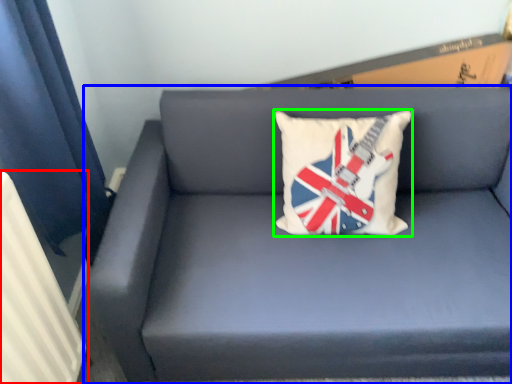
Question: Which is nearer to the radiator (highlighted by a red box)? studio couch (highlighted by a blue box) or pillow (highlighted by a green box).

Choices:
 (A) studio couch
 (B) pillow

Answer: (A)